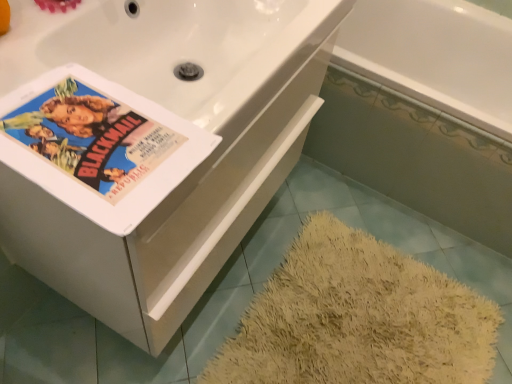
Question: From the image's perspective, relative to matte paper poster at upper left, is white glossy bathtub at lower right, the first bath in the front-to-back sequence, above or below?

Choices:
 (A) above
 (B) below

Answer: (A)

Question: Considering the positions of white glossy bathtub at lower right, arranged as the second bath when viewed from the back, and matte paper poster at upper left in the image, is white glossy bathtub at lower right, arranged as the second bath when viewed from the back, bigger or smaller than matte paper poster at upper left?

Choices:
 (A) big
 (B) small

Answer: (A)

Question: Estimate the real-world distances between objects in this image. Which object is closer to the white ceramic bathtub at upper right?

Choices:
 (A) matte paper poster at upper left
 (B) white glossy bathtub at lower right, arranged as the second bath when viewed from the back
 (C) white glossy bathtub at upper right, positioned as the 1th bath in back-to-front order

Answer: (A)

Question: Which of these objects is positioned farthest from the white glossy bathtub at lower right, arranged as the second bath when viewed from the back?

Choices:
 (A) matte paper poster at upper left
 (B) white ceramic bathtub at upper right
 (C) white glossy bathtub at upper right, which is counted as the second bath, starting from the front

Answer: (A)